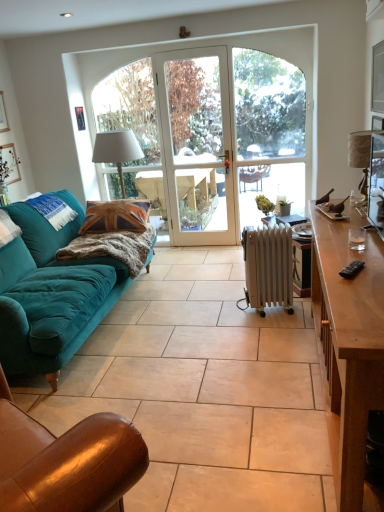
The image size is (384, 512). What do you see at coordinates (348, 346) in the screenshot?
I see `brown wooden desk at right` at bounding box center [348, 346].

What is the approximate width of teal velvet pillow at left?

teal velvet pillow at left is 13.21 inches in width.

Find the location of a particular element. teal velvet pillow at left is located at coordinates (52, 210).

The image size is (384, 512). In order to click on white glass screen door at center in this screenshot , I will do `click(197, 145)`.

Is brown leather chair at lower left positioned far away from white fabric lampshade at right, placed as the 1th lamp when sorted from right to left?

That's right, there is a large distance between brown leather chair at lower left and white fabric lampshade at right, placed as the 1th lamp when sorted from right to left.

Is brown leather chair at lower left at the right side of white fabric lampshade at right, which is the second lamp in back-to-front order?

No.

Is point (19, 446) farther from viewer compared to point (357, 151)?

No, it is not.

Could you tell me if brown leather chair at lower left is facing white fabric lampshade at right, positioned as the 2th lamp in left-to-right order?

Yes.

From the image's perspective, would you say velvet teal sofa at left is shown under white glass screen door at center?

Correct, velvet teal sofa at left appears lower than white glass screen door at center in the image.

Is velvet teal sofa at left in contact with white glass screen door at center?

No, velvet teal sofa at left is not touching white glass screen door at center.

Considering the positions of objects velvet teal sofa at left and white glass screen door at center in the image provided, who is more to the left, velvet teal sofa at left or white glass screen door at center?

Positioned to the left is velvet teal sofa at left.

Looking at this image, what's the angular difference between velvet teal sofa at left and white glass screen door at center's facing directions?

They differ by 89.4 degrees in their facing directions.

From a real-world perspective, between brown leather chair at lower left and clear glass door at center, who is vertically higher?

clear glass door at center.

Looking at this image, which of these two, brown leather chair at lower left or clear glass door at center, stands taller?

Standing taller between the two is clear glass door at center.

Considering the positions of objects brown leather chair at lower left and clear glass door at center in the image provided, who is more to the right, brown leather chair at lower left or clear glass door at center?

Positioned to the right is clear glass door at center.

Would you say brown leather chair at lower left is inside or outside clear glass door at center?

brown leather chair at lower left exists outside the volume of clear glass door at center.

Consider the image. Is white metallic radiator at center behind white fabric lampshade at center, which appears as the second lamp when viewed from the right?

That is False.

From a real-world perspective, is white metallic radiator at center above or below white fabric lampshade at center, which appears as the second lamp when viewed from the right?

In terms of real-world spatial position, white metallic radiator at center is below white fabric lampshade at center, which appears as the second lamp when viewed from the right.

Find the location of a particular element. This screenshot has width=384, height=512. radiator in front of the white fabric lampshade at center, which is counted as the second lamp, starting from the front is located at coordinates (268, 267).

In terms of width, does white metallic radiator at center look wider or thinner when compared to white fabric lampshade at center, which appears as the second lamp when viewed from the right?

In the image, white metallic radiator at center appears to be more narrow than white fabric lampshade at center, which appears as the second lamp when viewed from the right.

Does velvet teal sofa at left have a greater width compared to clear glass door at center?

Indeed, velvet teal sofa at left has a greater width compared to clear glass door at center.

Considering the sizes of objects velvet teal sofa at left and clear glass door at center in the image provided, who is taller, velvet teal sofa at left or clear glass door at center?

Standing taller between the two is clear glass door at center.

How different are the orientations of velvet teal sofa at left and clear glass door at center in degrees?

There is a 89.1-degree angle between the facing directions of velvet teal sofa at left and clear glass door at center.

Considering their positions, is clear glass door at center located in front of or behind white fabric lampshade at center, the 1th lamp from the left?

Visually, clear glass door at center is located behind white fabric lampshade at center, the 1th lamp from the left.

Can you confirm if clear glass door at center is taller than white fabric lampshade at center, the 1th lamp from the left?

Indeed, clear glass door at center has a greater height compared to white fabric lampshade at center, the 1th lamp from the left.

Is clear glass door at center positioned with its back to white fabric lampshade at center, which appears as the second lamp when viewed from the right?

That's not correct — clear glass door at center is not looking away from white fabric lampshade at center, which appears as the second lamp when viewed from the right.

Is point (294, 127) farther from viewer compared to point (99, 162)?

That is True.

Based on the photo, between white fabric lampshade at center, the first lamp positioned from the back, and white fabric lampshade at right, which is the second lamp in back-to-front order, which one has less height?

Standing shorter between the two is white fabric lampshade at right, which is the second lamp in back-to-front order.

Is white fabric lampshade at center, which appears as the second lamp when viewed from the right, looking in the opposite direction of white fabric lampshade at right, acting as the 1th lamp starting from the front?

white fabric lampshade at center, which appears as the second lamp when viewed from the right, is not turned away from white fabric lampshade at right, acting as the 1th lamp starting from the front.

From a real-world perspective, who is located lower, white fabric lampshade at center, which is counted as the second lamp, starting from the front, or white fabric lampshade at right, placed as the 1th lamp when sorted from right to left?

In real-world perspective, white fabric lampshade at center, which is counted as the second lamp, starting from the front, is lower.

Find the location of a particular element. chair in front of the white fabric lampshade at right, acting as the 1th lamp starting from the front is located at coordinates (66, 461).

In order to click on studio couch that appears below the white glass screen door at center (from the image's perspective) in this screenshot , I will do `click(50, 293)`.

Which object lies further to the anchor point white fabric lampshade at right, placed as the 1th lamp when sorted from right to left, brown wooden desk at right or brown leather chair at lower left?

Among the two, brown leather chair at lower left is located further to white fabric lampshade at right, placed as the 1th lamp when sorted from right to left.

From the picture: Estimate the real-world distances between objects in this image. Which object is further from brown wooden desk at right, white glass screen door at center or white metallic radiator at center?

white glass screen door at center is positioned further to the anchor brown wooden desk at right.

Considering their positions, is white metallic radiator at center positioned closer to velvet teal sofa at left than white fabric lampshade at right, which is the second lamp in back-to-front order?

white metallic radiator at center is closer to velvet teal sofa at left.

From the picture: Looking at the image, which one is located closer to clear glass door at center, brown leather chair at lower left or white metallic radiator at center?

white metallic radiator at center is closer to clear glass door at center.

Considering their positions, is brown leather chair at lower left positioned further to white fabric lampshade at right, acting as the 1th lamp starting from the front, than white glass screen door at center?

Based on the image, white glass screen door at center appears to be further to white fabric lampshade at right, acting as the 1th lamp starting from the front.

From the image, which object appears to be farther from white fabric lampshade at center, the 1th lamp from the left, white fabric lampshade at right, which is the second lamp in back-to-front order, or brown leather chair at lower left?

brown leather chair at lower left.

Based on their spatial positions, is brown wooden desk at right or white fabric lampshade at right, which is the second lamp in back-to-front order, closer to white glass screen door at center?

white fabric lampshade at right, which is the second lamp in back-to-front order.

Considering their positions, is white metallic radiator at center positioned further to brown wooden desk at right than white glass screen door at center?

white glass screen door at center lies further to brown wooden desk at right than the other object.

Locate an element on the screen. This screenshot has width=384, height=512. desk between teal velvet pillow at left and white fabric lampshade at right, placed as the 1th lamp when sorted from right to left is located at coordinates (348, 346).

Find the location of a particular element. This screenshot has height=512, width=384. glass door positioned between brown wooden desk at right and white glass screen door at center from near to far is located at coordinates (268, 131).

The width and height of the screenshot is (384, 512). Find the location of `lamp between teal velvet pillow at left and clear glass door at center`. lamp between teal velvet pillow at left and clear glass door at center is located at coordinates (117, 150).

This screenshot has width=384, height=512. What are the coordinates of `lamp between brown leather chair at lower left and white metallic radiator at center in the front-back direction` in the screenshot? It's located at (361, 154).